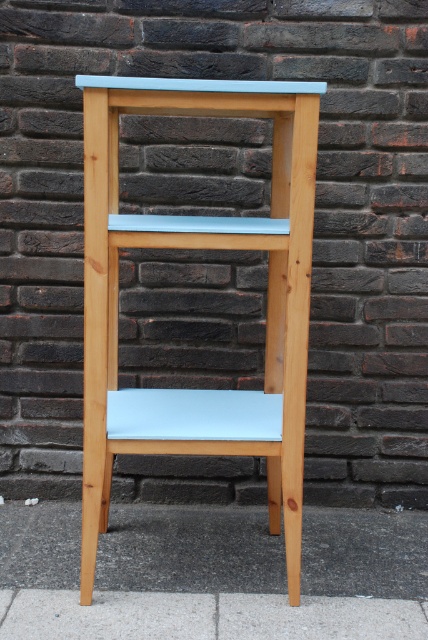
Question: Is light blue matte wood chair at center to the right of gray concrete pavement at lower center from the viewer's perspective?

Choices:
 (A) no
 (B) yes

Answer: (A)

Question: Which of the following is the closest to the observer?

Choices:
 (A) (273, 312)
 (B) (175, 506)

Answer: (A)

Question: Which point is closer to the camera?

Choices:
 (A) gray concrete pavement at lower center
 (B) light blue matte wood chair at center

Answer: (B)

Question: Where is light blue matte wood chair at center located in relation to gray concrete pavement at lower center in the image?

Choices:
 (A) left
 (B) right

Answer: (A)

Question: Does light blue matte wood chair at center come in front of gray concrete pavement at lower center?

Choices:
 (A) no
 (B) yes

Answer: (B)